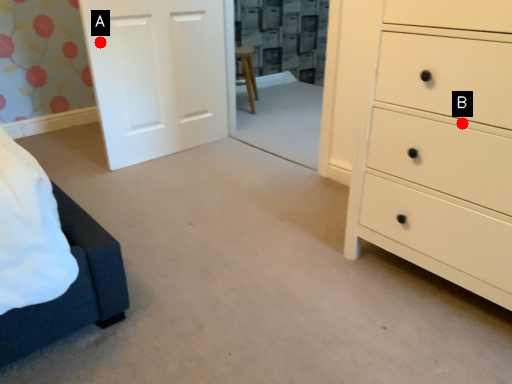
Question: Two points are circled on the image, labeled by A and B beside each circle. Which point appears closest to the camera in this image?

Choices:
 (A) A is closer
 (B) B is closer

Answer: (B)